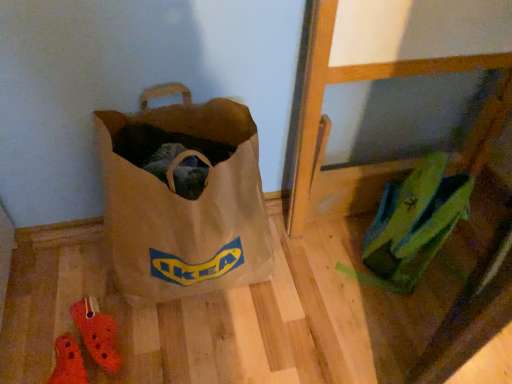
Locate an element on the screen. free area in between green fabric backpack at upper right and orange croc at lower left, the 1th footwear viewed from the top is located at coordinates (284, 299).